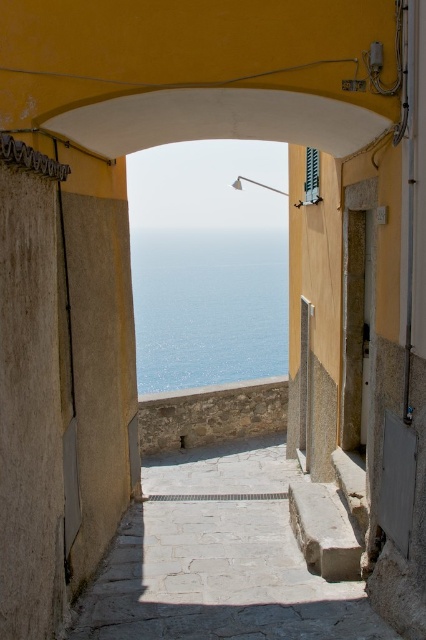
Looking at this image, you are standing at the entrance of the passageway and want to reach the blue water at center. Which direction should you walk relative to the stone steps at center?

You should walk to the left of the stone steps at center to reach the blue water at center since the blue water at center is to the left of the stone steps at center according to the description.

You are standing at the entrance of the passageway and want to reach the blue water at center. The stone steps at center are in your way. Can you walk around them to get to the water without stepping on the steps?

The stone steps at center and blue water at center are 127.31 meters apart from each other, so you can walk around the stone steps at center to reach the blue water at center as there is enough space between them.